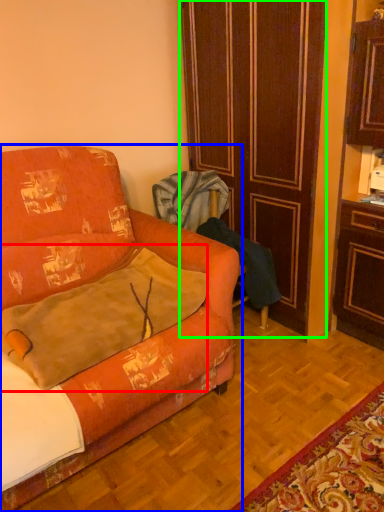
Question: Based on their relative distances, which object is farther from throw pillow (highlighted by a red box)? Choose from studio couch (highlighted by a blue box) and door (highlighted by a green box).

Choices:
 (A) studio couch
 (B) door

Answer: (B)